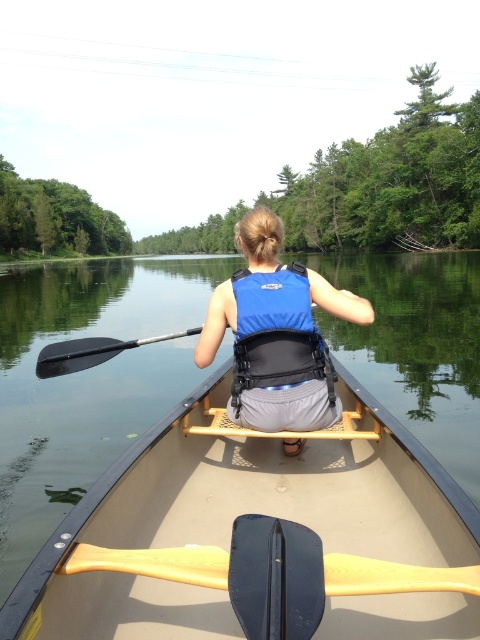
You are standing on the dock and want to board the tan plastic canoe at center. If the dock is 5 feet long, can you reach the canoe from the end of the dock?

The tan plastic canoe at center is 4.07 feet away from the viewer. Since the dock is 5 feet long, you can reach the canoe from the end of the dock as the distance is shorter than the dock length.

You are planning to store the tan plastic canoe at center and the black rubber paddle at left in a narrow storage compartment. Which item might have difficulty fitting due to its width?

The black rubber paddle at left might have difficulty fitting in the narrow storage compartment because it is wider than the tan plastic canoe at center.